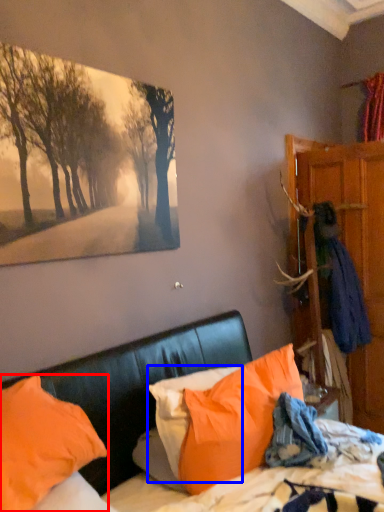
Question: Which point is closer to the camera, pillow (highlighted by a red box) or pillow (highlighted by a blue box)?

Choices:
 (A) pillow
 (B) pillow

Answer: (A)